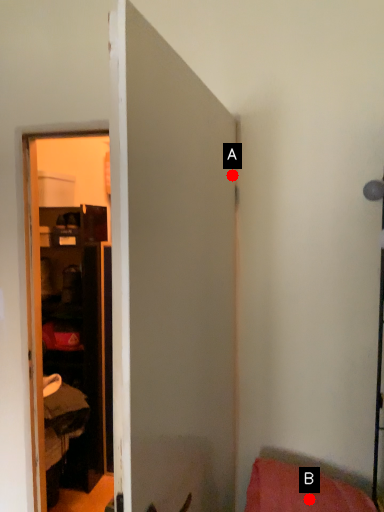
Question: Two points are circled on the image, labeled by A and B beside each circle. Which of the following is the closest to the observer?

Choices:
 (A) A is closer
 (B) B is closer

Answer: (B)